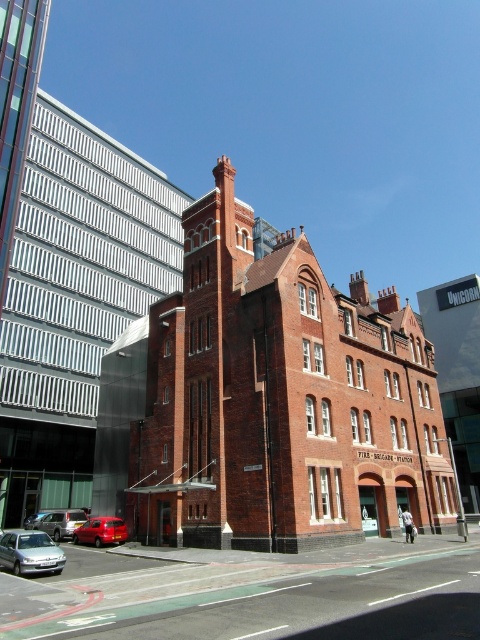
Which of these two, metallic red van at center or silver metallic car at center, stands taller?

Standing taller between the two is silver metallic car at center.

Who is shorter, metallic red van at center or silver metallic car at center?

metallic red van at center is shorter.

Between point (90, 516) and point (55, 536), which one is positioned in front?

Positioned in front is point (55, 536).

Find the location of a particular element. metallic red van at center is located at coordinates (100, 531).

Who is shorter, silver metallic sedan at lower left or metallic red van at center?

With less height is silver metallic sedan at lower left.

Who is more forward, (32, 548) or (83, 525)?

Point (32, 548) is more forward.

The width and height of the screenshot is (480, 640). I want to click on silver metallic sedan at lower left, so click(31, 552).

Is silver metallic sedan at lower left above silver metallic car at center?

Yes, silver metallic sedan at lower left is above silver metallic car at center.

Is silver metallic sedan at lower left wider than silver metallic car at center?

No, silver metallic sedan at lower left is not wider than silver metallic car at center.

Identify the location of silver metallic sedan at lower left. The image size is (480, 640). (31, 552).